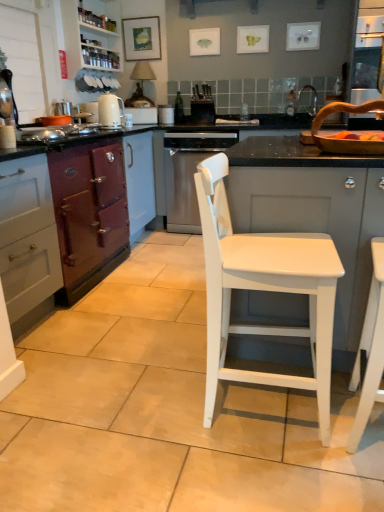
Question: Which is correct: white wood cabinet at upper left, placed as the 2th cabinetry when sorted from right to left, is inside black matte oven at center, which is the first appliance in right-to-left order, or outside of it?

Choices:
 (A) inside
 (B) outside

Answer: (B)

Question: Considering the positions of white wood cabinet at upper left, placed as the 2th cabinetry when sorted from right to left, and black matte oven at center, which is the first appliance in right-to-left order, in the image, is white wood cabinet at upper left, placed as the 2th cabinetry when sorted from right to left, taller or shorter than black matte oven at center, which is the first appliance in right-to-left order,?

Choices:
 (A) short
 (B) tall

Answer: (B)

Question: Which object is positioned farthest from the white glossy electric kettle at center-left?

Choices:
 (A) white ceramic toaster at upper center, the 3th appliance when ordered from right to left
 (B) matte burgundy wood stove at left, marked as the third cabinetry in a right-to-left arrangement
 (C) black matte oven at center, which is the first appliance in right-to-left order
 (D) metallic silver faucet at upper right
 (E) white matte cabinet at center, placed as the fourth cabinetry when sorted from left to right

Answer: (E)

Question: Considering the real-world distances, which object is closest to the purple matte oven at left, which appears as the first cabinetry when viewed from the left?

Choices:
 (A) black matte oven at center, which is the first appliance in right-to-left order
 (B) white wood cabinet at upper left, the third cabinetry when ordered from left to right
 (C) matte burgundy wood stove at left, marked as the third cabinetry in a right-to-left arrangement
 (D) white ceramic sink at upper right
 (E) white glossy electric kettle at center-left

Answer: (C)